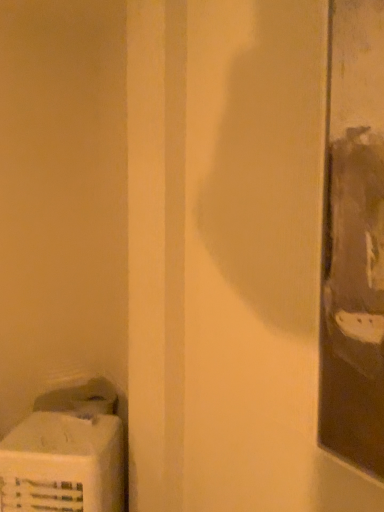
Find the location of a particular element. The height and width of the screenshot is (512, 384). white plastic air conditioner at lower left is located at coordinates (63, 464).

This screenshot has height=512, width=384. What do you see at coordinates (63, 464) in the screenshot? I see `white plastic air conditioner at lower left` at bounding box center [63, 464].

Where is `white plastic air conditioner at lower left`? The height and width of the screenshot is (512, 384). white plastic air conditioner at lower left is located at coordinates pos(63,464).